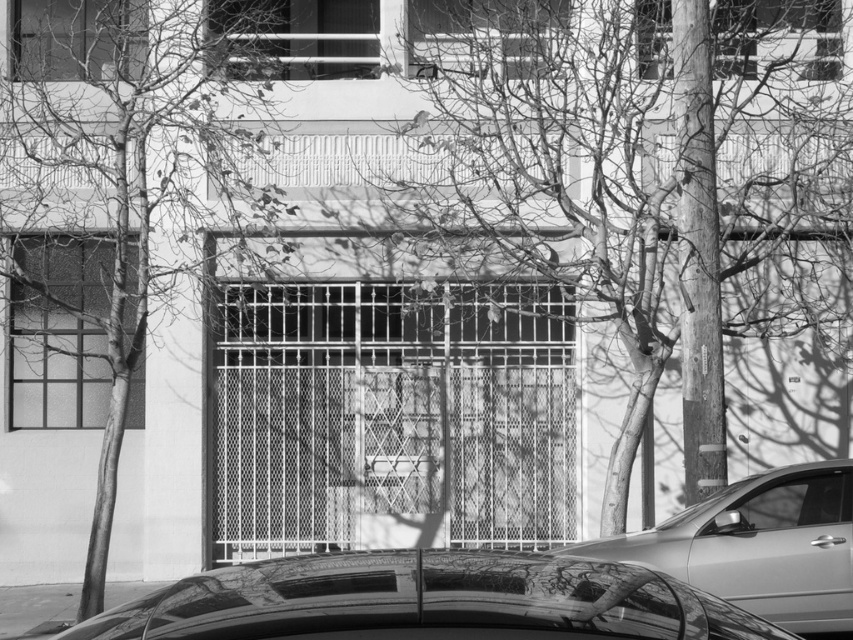
Who is more forward, (500, 20) or (744, 548)?

Point (744, 548) is in front.

Can you confirm if bare branches at center is shorter than metallic silver car at lower right?

Indeed, bare branches at center has a lesser height compared to metallic silver car at lower right.

Between point (519, 211) and point (828, 461), which one is positioned in front?

Point (828, 461) is more forward.

Identify the location of bare branches at center. This screenshot has height=640, width=853. click(x=647, y=177).

Which of these two, metallic silver car at lower right or clear glass window at lower right, stands shorter?

clear glass window at lower right

Can you confirm if metallic silver car at lower right is positioned to the left of clear glass window at lower right?

Yes, metallic silver car at lower right is to the left of clear glass window at lower right.

The image size is (853, 640). What do you see at coordinates (759, 545) in the screenshot? I see `metallic silver car at lower right` at bounding box center [759, 545].

Where is `metallic silver car at lower right`? Image resolution: width=853 pixels, height=640 pixels. metallic silver car at lower right is located at coordinates (759, 545).

Can you confirm if bare branches at center is taller than bare branches at left?

Incorrect, bare branches at center's height is not larger of bare branches at left's.

Does point (693, 256) lie behind point (171, 266)?

No, it is not.

Locate an element on the screen. bare branches at center is located at coordinates (647, 177).